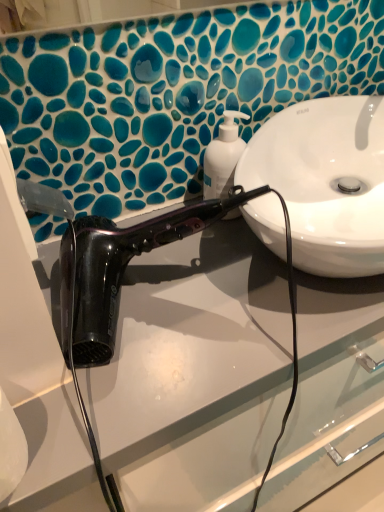
Image resolution: width=384 pixels, height=512 pixels. Identify the location of vacant space positioned to the left of white glossy soap dispenser at center. (148, 209).